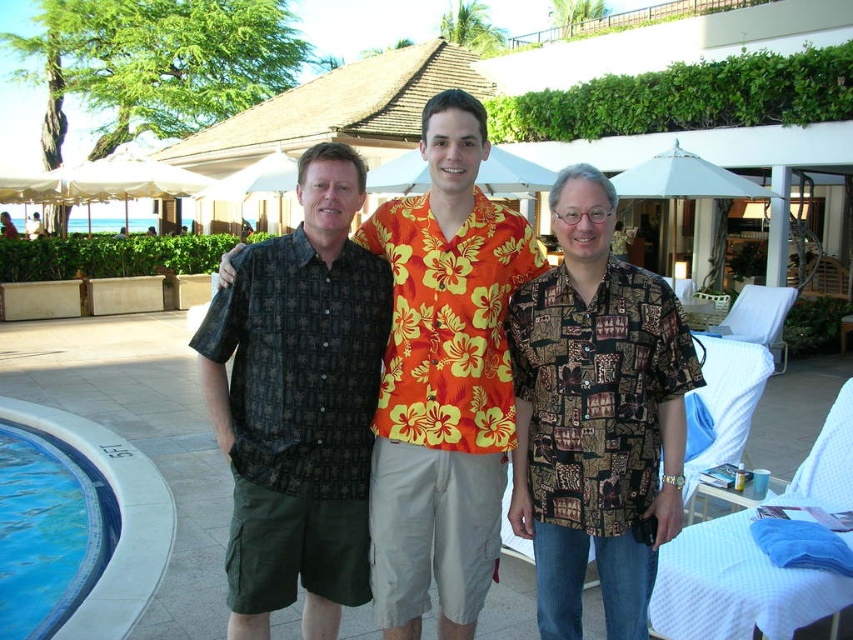
Question: Among these points, which one is nearest to the camera?

Choices:
 (A) (154, 577)
 (B) (614, 561)
 (C) (393, 332)
 (D) (370, 371)

Answer: (B)

Question: Which point is closer to the camera taking this photo?

Choices:
 (A) (276, 355)
 (B) (640, 330)
 (C) (416, 404)

Answer: (B)

Question: Does dark brown patterned shirt at center have a larger size compared to printed fabric shirt at center?

Choices:
 (A) no
 (B) yes

Answer: (A)

Question: Can you confirm if floral print shirt at center is positioned to the right of dark brown patterned shirt at center?

Choices:
 (A) no
 (B) yes

Answer: (B)

Question: Which of the following is the farthest from the observer?

Choices:
 (A) (369, 308)
 (B) (631, 394)
 (C) (33, 576)

Answer: (C)

Question: Can you confirm if dark brown patterned shirt at center is smaller than blue tile swimming pool at lower left?

Choices:
 (A) yes
 (B) no

Answer: (A)